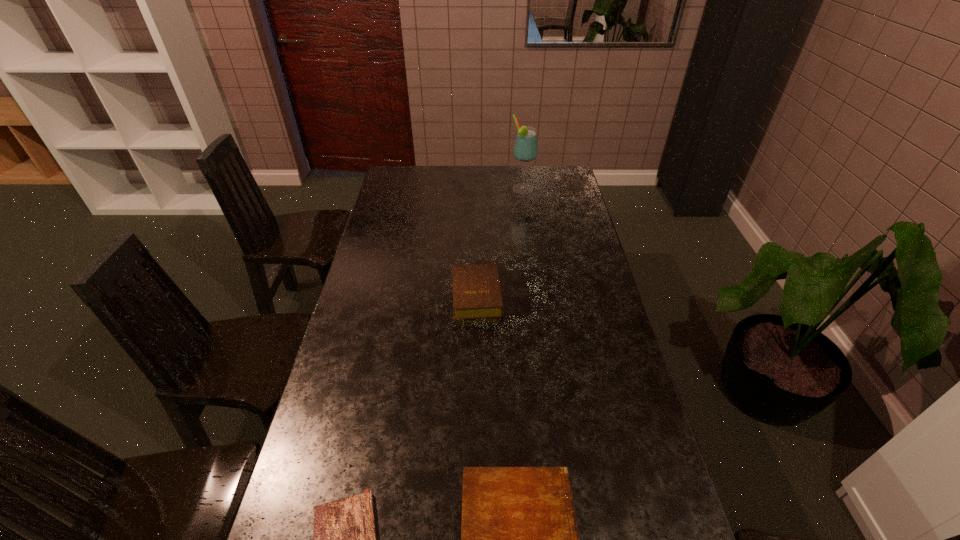
Identify the location of the tallest object. This screenshot has width=960, height=540. (525, 149).

Find the location of a particular element. This screenshot has height=540, width=960. alcohol is located at coordinates (525, 149).

I want to click on the farthest Bible, so click(x=476, y=289).

In order to click on the second tallest object in this screenshot , I will do `click(476, 289)`.

What are the coordinates of `free spot located on the left of the tallest object` in the screenshot? It's located at (494, 190).

This screenshot has width=960, height=540. Find the location of `free location located on the back of the third nearest object`. free location located on the back of the third nearest object is located at coordinates (477, 237).

Identify the location of object at the far edge. The width and height of the screenshot is (960, 540). (525, 149).

The height and width of the screenshot is (540, 960). In the image, there is a desktop. What are the coordinates of `vacant space at the left edge` in the screenshot? It's located at (393, 301).

Where is `vacant region at the right edge`? vacant region at the right edge is located at coordinates (x=575, y=217).

What are the coordinates of `vacant region at the far right corner` in the screenshot? It's located at (544, 187).